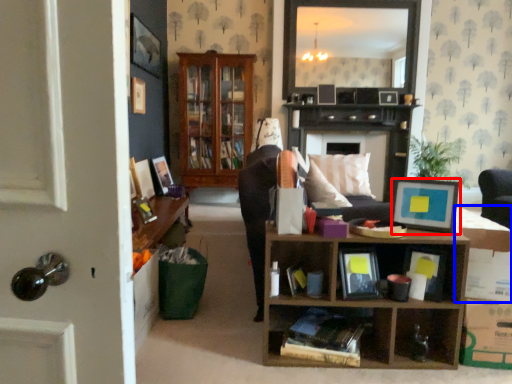
Question: Which point is closer to the camera, picture frame (highlighted by a red box) or cardboard box (highlighted by a blue box)?

Choices:
 (A) picture frame
 (B) cardboard box

Answer: (B)